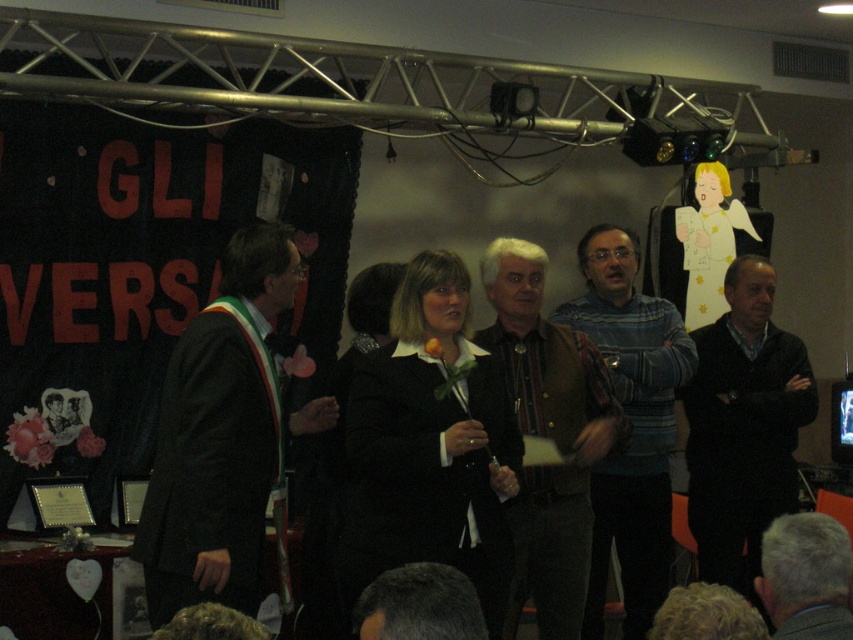
Question: Which object appears farthest from the camera in this image?

Choices:
 (A) dark suit at left
 (B) black sweater at right
 (C) gray hair at lower right

Answer: (B)

Question: In this image, where is gray hair at lower right located relative to dark brown hair at lower center?

Choices:
 (A) below
 (B) above

Answer: (A)

Question: Does dark suit at left come behind black sweater at right?

Choices:
 (A) no
 (B) yes

Answer: (A)

Question: Which of the following is the farthest from the observer?

Choices:
 (A) (639, 392)
 (B) (534, 333)
 (C) (421, 580)
 (D) (440, 520)

Answer: (A)

Question: Observing the image, what is the correct spatial positioning of black matte suit at center in reference to dark suit at left?

Choices:
 (A) right
 (B) left

Answer: (A)

Question: Which object is the closest to the dark suit at left?

Choices:
 (A) brown textured sweater at center
 (B) striped sweater at center
 (C) black sweater at right
 (D) black matte suit at center

Answer: (D)